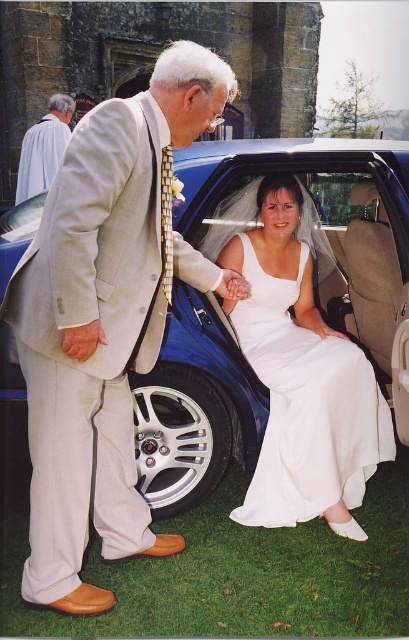
Question: Is blue metallic car at center smaller than silver metallic tire at lower center?

Choices:
 (A) yes
 (B) no

Answer: (B)

Question: Estimate the real-world distances between objects in this image. Which object is farther from the blue metallic car at center?

Choices:
 (A) light beige suit at center
 (B) white satin dress at center
 (C) silver metallic tire at lower center
 (D) light gray suit at upper left

Answer: (D)

Question: Which of the following is the farthest from the observer?

Choices:
 (A) white satin dress at center
 (B) light beige suit at center

Answer: (A)

Question: Is light beige suit at center thinner than silver metallic tire at lower center?

Choices:
 (A) yes
 (B) no

Answer: (B)

Question: Is light beige suit at center to the left of blue metallic car at center from the viewer's perspective?

Choices:
 (A) no
 (B) yes

Answer: (B)

Question: Which object appears closest to the camera in this image?

Choices:
 (A) light beige suit at center
 (B) white satin dress at center
 (C) silver metallic tire at lower center

Answer: (A)